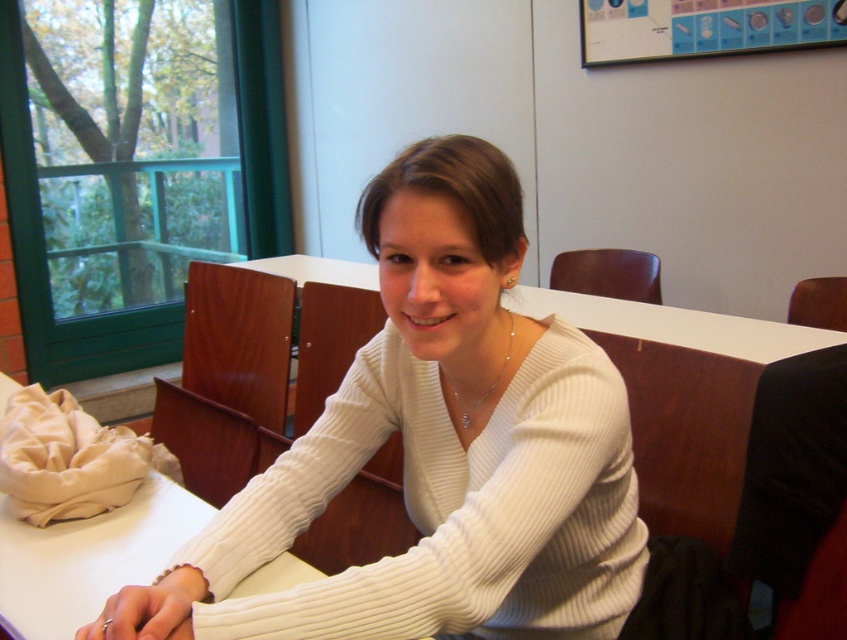
What do you see at coordinates (436, 449) in the screenshot?
I see `white ribbed sweater at center` at bounding box center [436, 449].

Who is lower down, white ribbed sweater at center or white ribbed sweater at upper center?

Positioned lower is white ribbed sweater at upper center.

Find the location of a particular element. This screenshot has width=847, height=640. white ribbed sweater at center is located at coordinates (436, 449).